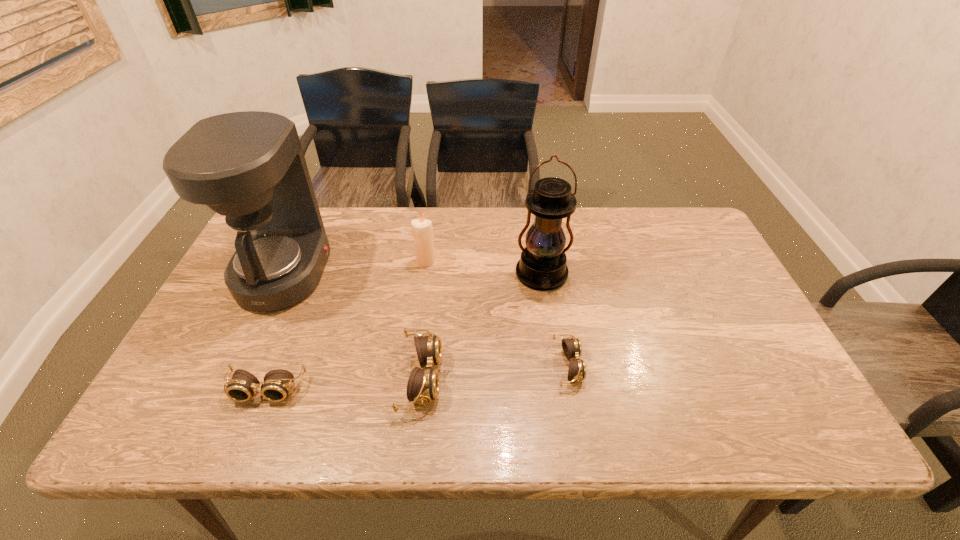
Where is `the second tallest goggles`? This screenshot has width=960, height=540. the second tallest goggles is located at coordinates (277, 383).

You are a GUI agent. You are given a task and a screenshot of the screen. Output one action in this format:
    pyautogui.click(x=<x>, y=<y>)
    Task: Click on the second shortest object
    The image size is (960, 540).
    Given the screenshot: What is the action you would take?
    [x=277, y=383]

This screenshot has height=540, width=960. What are the coordinates of `the second goggles from right to left` in the screenshot? It's located at (423, 385).

Image resolution: width=960 pixels, height=540 pixels. I want to click on the tallest goggles, so click(x=423, y=385).

In order to click on the shortest object in this screenshot , I will do `click(572, 348)`.

The width and height of the screenshot is (960, 540). What are the coordinates of `the shortest goggles` in the screenshot? It's located at point(572,348).

Where is `coffee maker`? This screenshot has width=960, height=540. coffee maker is located at coordinates (249, 166).

At what (x,y) coordinates should I click in order to perform the action: click on the fourth shortest object. Please return your answer as a coordinate pair (x, y). Image resolution: width=960 pixels, height=540 pixels. Looking at the image, I should click on (421, 228).

Locate an element on the screen. lantern is located at coordinates (542, 266).

At what (x,y) coordinates should I click in order to perform the action: click on free space located 0.370m through the lenses of the third shortest object. Please return your answer as a coordinate pair (x, y). The height and width of the screenshot is (540, 960). Looking at the image, I should click on (600, 377).